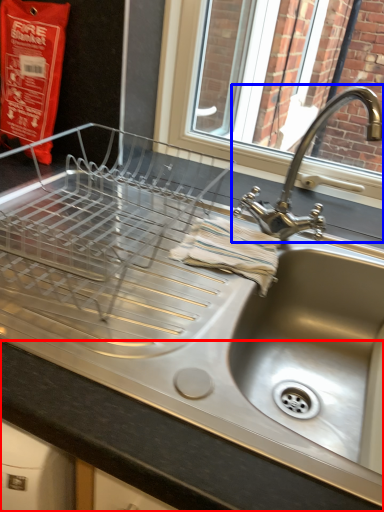
Question: Among these objects, which one is nearest to the camera, counter top (highlighted by a red box) or tap (highlighted by a blue box)?

Choices:
 (A) counter top
 (B) tap

Answer: (A)